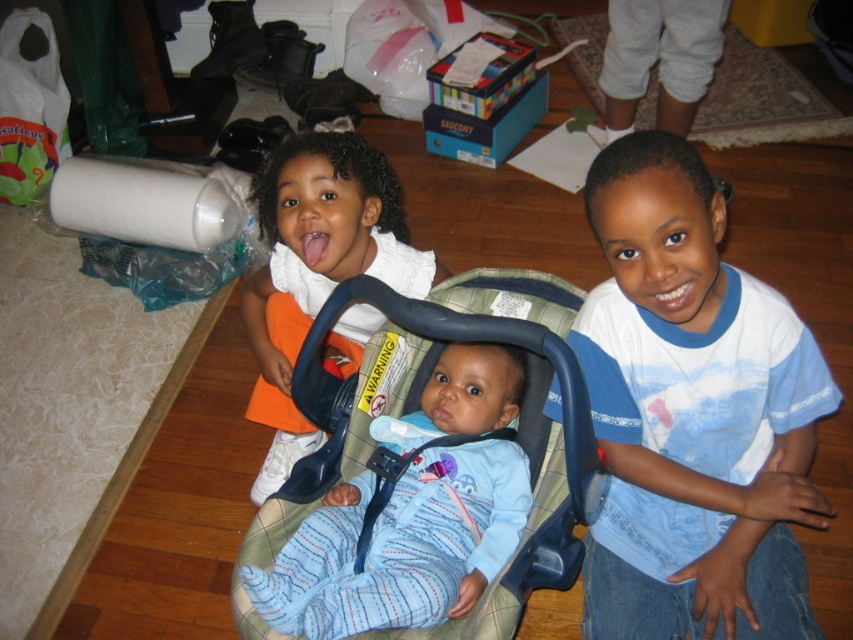
Between blue cotton shirt at right and matte white shirt at upper left, which one appears on the left side from the viewer's perspective?

matte white shirt at upper left

Can you confirm if blue cotton shirt at right is wider than matte white shirt at upper left?

Yes, blue cotton shirt at right is wider than matte white shirt at upper left.

Is point (715, 496) more distant than point (369, 273)?

No, it is in front of (369, 273).

Find the location of a particular element. This screenshot has height=640, width=853. blue cotton shirt at right is located at coordinates (693, 413).

Is blue cotton shirt at right smaller than plaid fabric baby carriage at center?

Incorrect, blue cotton shirt at right is not smaller in size than plaid fabric baby carriage at center.

Is blue cotton shirt at right below plaid fabric baby carriage at center?

Incorrect, blue cotton shirt at right is not positioned below plaid fabric baby carriage at center.

Where is `blue cotton shirt at right`? The width and height of the screenshot is (853, 640). blue cotton shirt at right is located at coordinates (693, 413).

The image size is (853, 640). Find the location of `blue cotton shirt at right`. blue cotton shirt at right is located at coordinates (693, 413).

Which of these two, plaid fabric baby carriage at center or matte white shirt at upper left, stands shorter?

With less height is plaid fabric baby carriage at center.

Who is more distant from viewer, (514, 573) or (357, 349)?

Point (357, 349)

I want to click on plaid fabric baby carriage at center, so click(x=416, y=406).